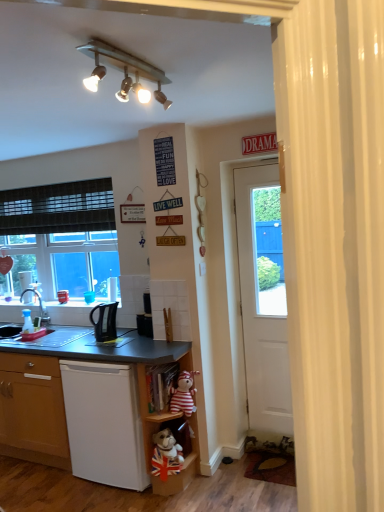
This screenshot has height=512, width=384. In order to click on free space to the right of wooden shelf at lower center, arranged as the second shelf when ordered from the bottom in this screenshot , I will do `click(223, 482)`.